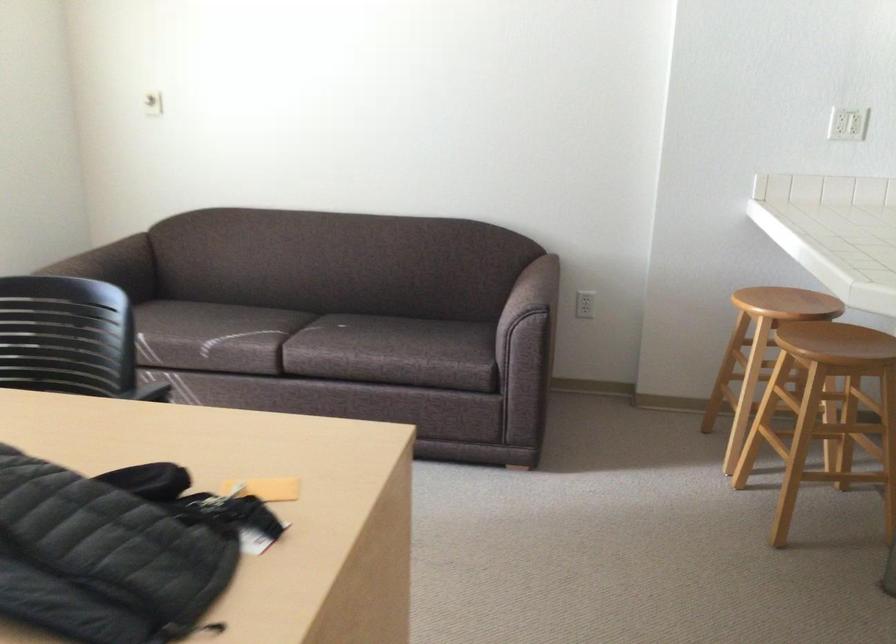
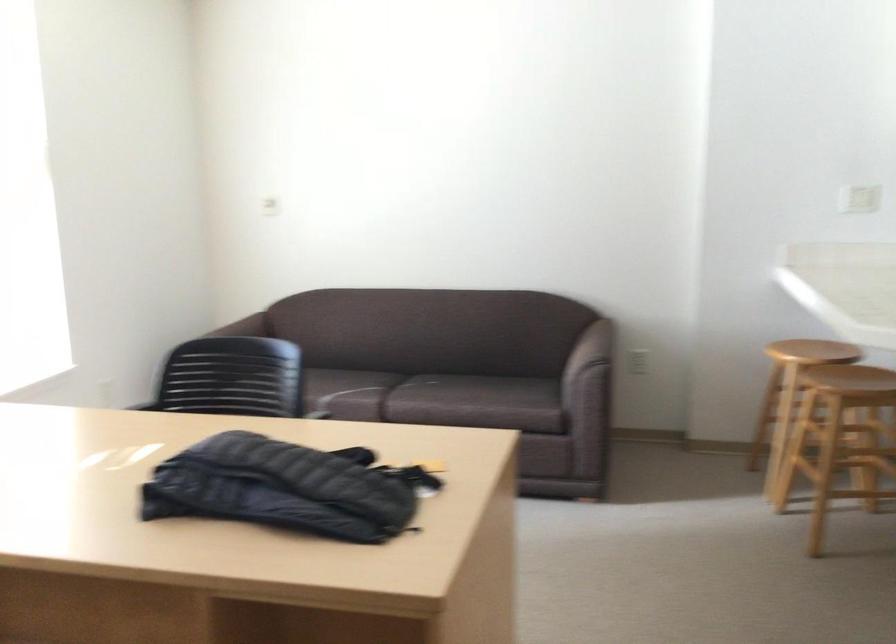
In the second image, find the point that corresponds to pixel 804 447 in the first image.

(837, 466)